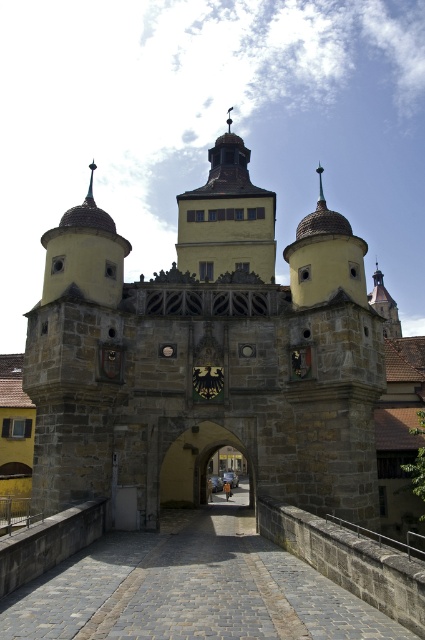
You are a medieval knight approaching the historic stone gatehouse. You need to pass through the stone archway at center to enter the castle grounds. However, there is a yellow stone tower at center blocking your path. Can you go through the archway without climbing over the tower?

The yellow stone tower at center is above the stone archway at center, so the tower does not block the path. You can pass through the stone archway at center without climbing over the tower.

You are standing in front of the historic stone gatehouse and want to enter through the central gate. As you look at the yellow stone tower at center and the stone archway at center, which one is positioned to the left side of the other?

The yellow stone tower at center is to the left of the stone archway at center.

You are standing at the entrance of the historic stone gatehouse. Looking straight ahead, you see a point marked at coordinates (206, 356). What structure is located at that point?

The point at (206, 356) indicates the location of the stone church at center.